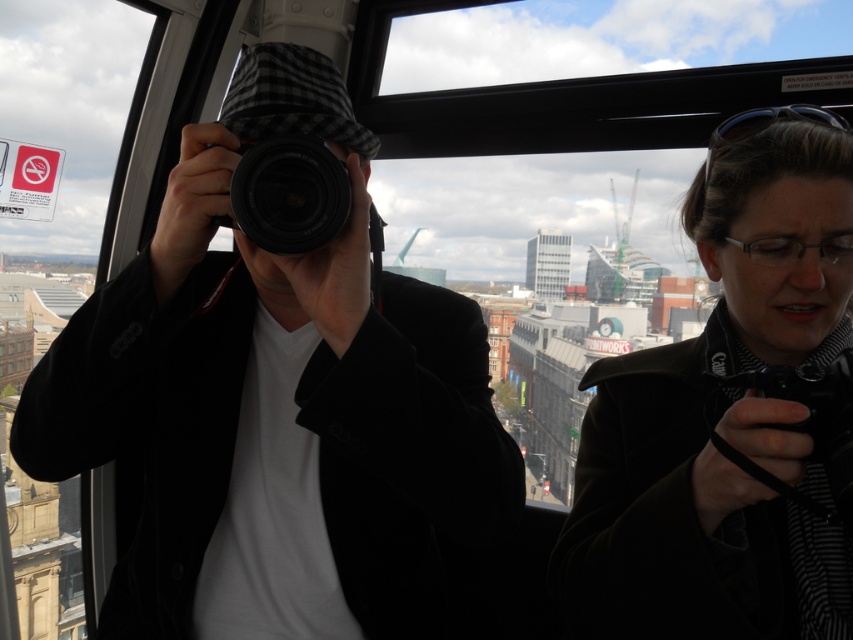
Does black plastic camera at center have a greater width compared to transparent glass window at lower left?

Correct, the width of black plastic camera at center exceeds that of transparent glass window at lower left.

Who is more distant from viewer, (305, 138) or (80, 612)?

The point (80, 612) is more distant.

Is point (331, 230) positioned after point (80, 566)?

No, (331, 230) is in front of (80, 566).

Identify the location of black plastic camera at center. The image size is (853, 640). (288, 195).

Can you confirm if matte black camera at right is positioned below transparent glass window at lower left?

Actually, matte black camera at right is above transparent glass window at lower left.

Who is taller, matte black camera at right or transparent glass window at lower left?

Standing taller between the two is matte black camera at right.

Is point (764, 300) behind point (61, 552)?

No.

Locate an element on the screen. This screenshot has width=853, height=640. matte black camera at right is located at coordinates (722, 417).

Which is behind, point (790, 458) or point (347, 196)?

Positioned behind is point (347, 196).

Between matte black camera at right and black plastic camera at center, which one is positioned higher?

black plastic camera at center is above.

Does point (595, 502) come in front of point (344, 220)?

No, (595, 502) is behind (344, 220).

Identify the location of matte black camera at right. (722, 417).